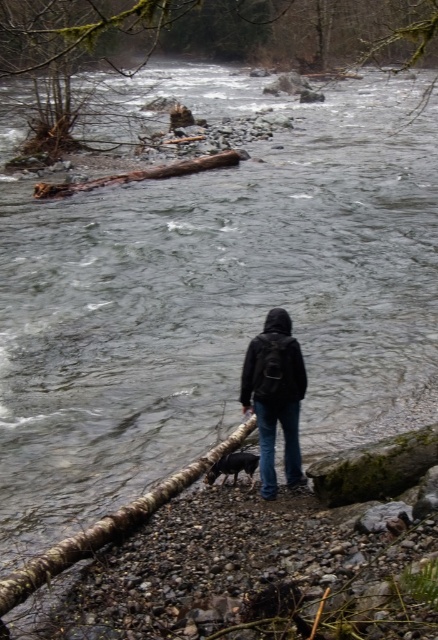
Between point (102, 541) and point (88, 182), which one is positioned in front?

Point (102, 541) is more forward.

Locate an element on the screen. The width and height of the screenshot is (438, 640). brown rough log at lower center is located at coordinates (110, 525).

Between point (105, 518) and point (247, 349), which one is positioned behind?

Positioned behind is point (247, 349).

In the scene shown: Is brown rough log at lower center bigger than black matte jacket at center?

Yes, brown rough log at lower center is bigger than black matte jacket at center.

What do you see at coordinates (110, 525) in the screenshot? The height and width of the screenshot is (640, 438). I see `brown rough log at lower center` at bounding box center [110, 525].

Locate an element on the screen. brown rough log at lower center is located at coordinates (110, 525).

Is the position of green mossy branch at upper center less distant than that of brown rough log at lower center?

No, green mossy branch at upper center is behind brown rough log at lower center.

Is point (267, 45) farther from viewer compared to point (38, 582)?

Yes, it is behind point (38, 582).

The image size is (438, 640). In order to click on green mossy branch at upper center in this screenshot , I will do `click(221, 32)`.

Identify the location of green mossy branch at upper center. (221, 32).